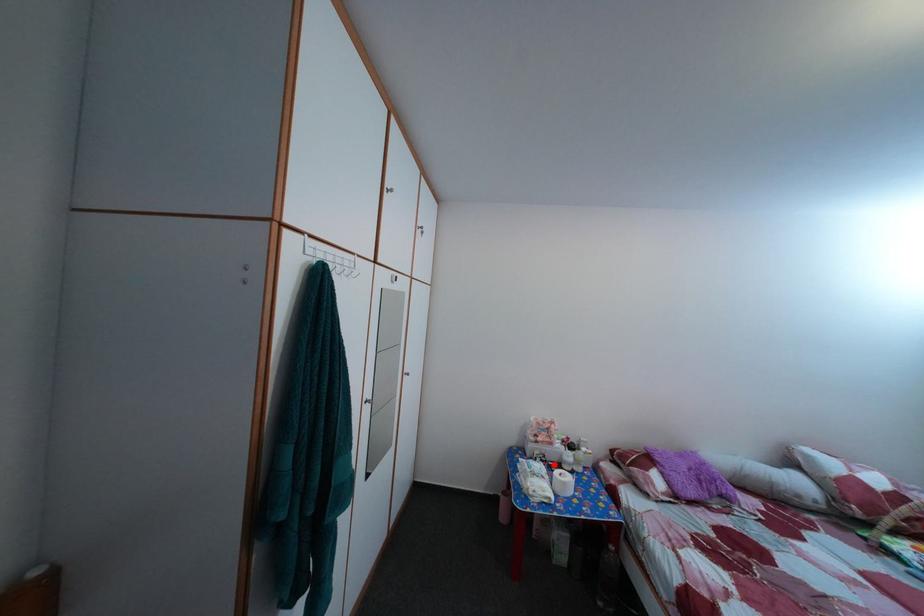
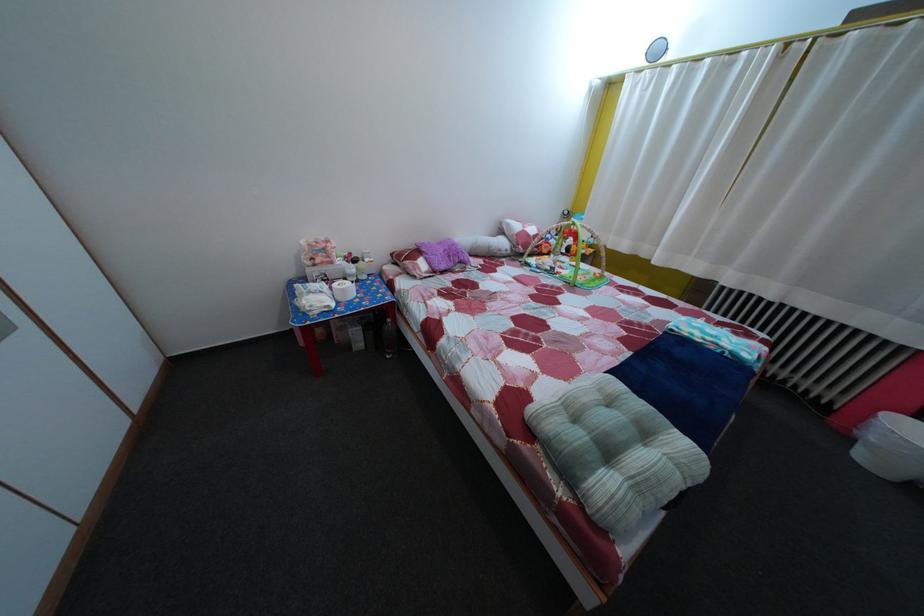
The point at the highlighted location is marked in the first image. Where is the corresponding point in the second image?

(335, 284)